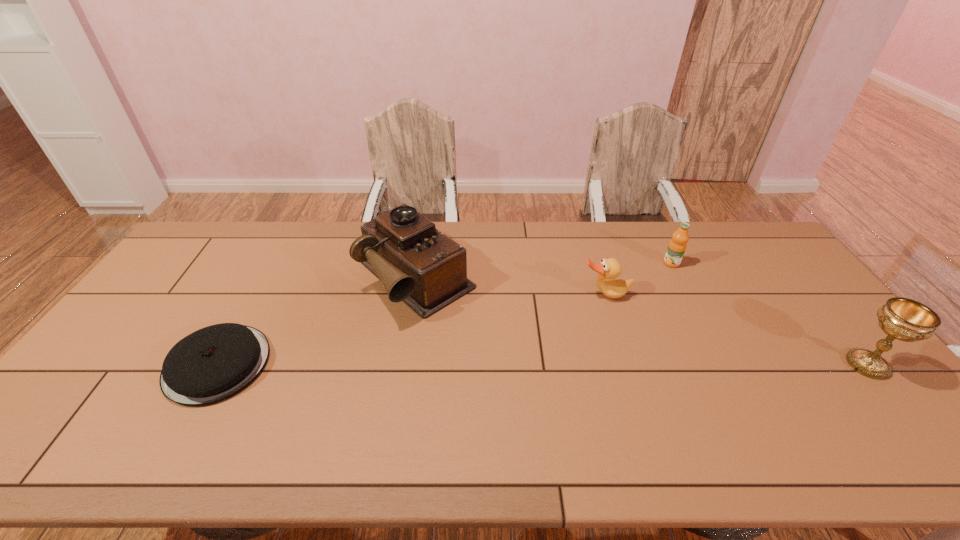
Where is `vacant space in between the pancake and the phonograph_record`? vacant space in between the pancake and the phonograph_record is located at coordinates (316, 321).

Locate an element on the screen. This screenshot has height=540, width=960. vacant area that lies between the rightmost object and the second object from left to right is located at coordinates (641, 321).

The image size is (960, 540). In order to click on free spot between the second object from left to right and the shortest object in this screenshot , I will do `click(316, 321)`.

Find the location of `free space that is in between the phonograph_record and the pancake`. free space that is in between the phonograph_record and the pancake is located at coordinates (316, 321).

Image resolution: width=960 pixels, height=540 pixels. I want to click on vacant area that lies between the rightmost object and the phonograph_record, so click(x=641, y=321).

Identify which object is the nearest to the chalice. Please provide its 2D coordinates. Your answer should be formatted as a tuple, i.e. [(x, y)], where the tuple contains the x and y coordinates of a point satisfying the conditions above.

[(677, 246)]

This screenshot has width=960, height=540. What are the coordinates of `object that is the fourth closest to the leftmost object` in the screenshot? It's located at (901, 318).

Where is `vacant space that satisfies the following two spatial constraints: 1. on the front side of the phonograph_record; 2. on the right side of the chalice`? vacant space that satisfies the following two spatial constraints: 1. on the front side of the phonograph_record; 2. on the right side of the chalice is located at coordinates (400, 364).

Identify the location of free spot that satisfies the following two spatial constraints: 1. on the back side of the phonograph_record; 2. on the right side of the orange juice. The image size is (960, 540). (418, 264).

In order to click on free spot that satisfies the following two spatial constraints: 1. on the front side of the rightmost object; 2. on the left side of the second object from left to right in this screenshot , I will do `click(400, 364)`.